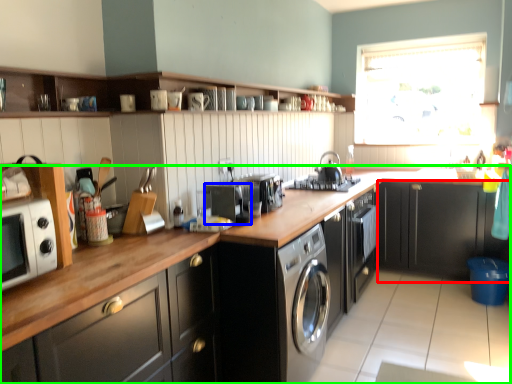
Question: Which object is positioned farthest from cabinetry (highlighted by a red box)? Select from appliance (highlighted by a blue box) and countertop (highlighted by a green box).

Choices:
 (A) appliance
 (B) countertop

Answer: (A)